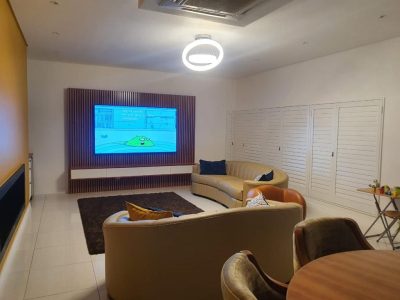
Where is `doors`? This screenshot has width=400, height=300. doors is located at coordinates (350, 155).